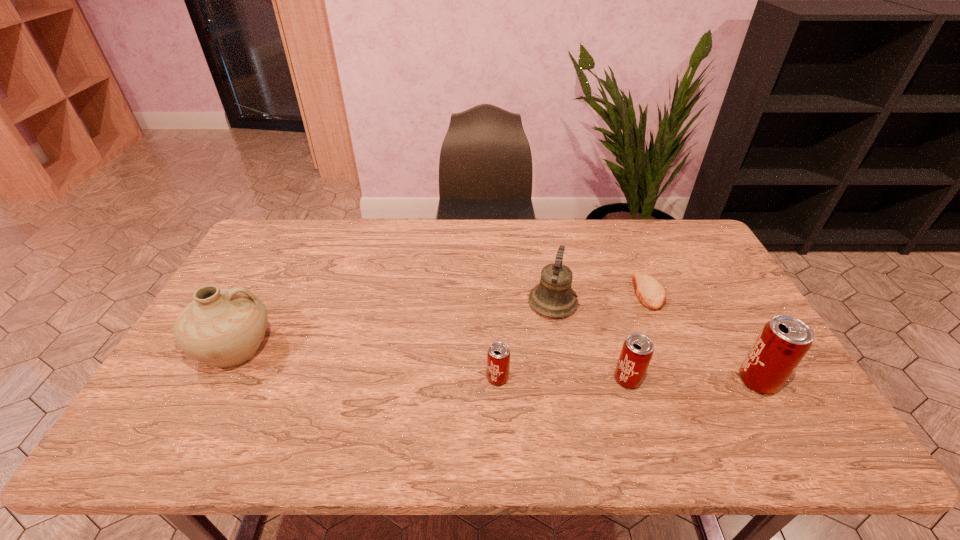
Please point out where to position a new beer can on the left to maintain spacing. Please provide its 2D coordinates. Your answer should be formatted as a tuple, i.e. [(x, y)], where the tuple contains the x and y coordinates of a point satisfying the conditions above.

[(369, 376)]